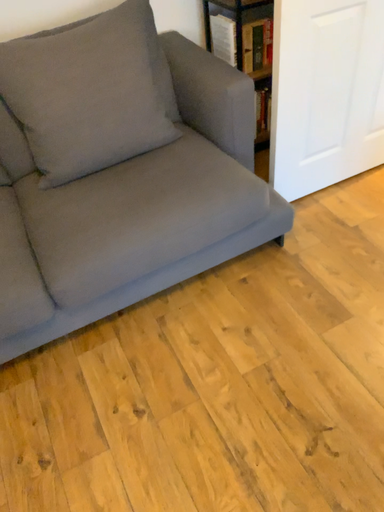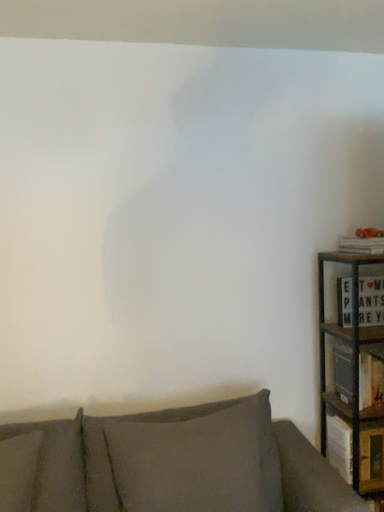
Question: How did the camera likely rotate when shooting the video?

Choices:
 (A) rotated left
 (B) rotated right

Answer: (A)